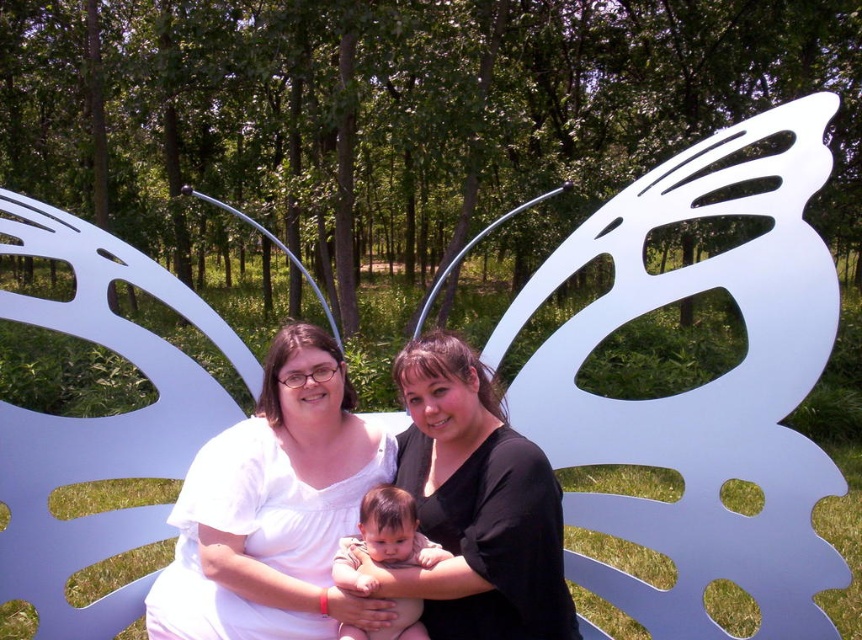
What do you see at coordinates (273, 508) in the screenshot? The image size is (862, 640). I see `white matte shirt at center` at bounding box center [273, 508].

Does white matte shirt at center appear under black matte shirt at center?

Indeed, white matte shirt at center is positioned under black matte shirt at center.

Is point (334, 506) positioned in front of point (498, 636)?

No, it is behind (498, 636).

The width and height of the screenshot is (862, 640). Identify the location of white matte shirt at center. (273, 508).

Can you confirm if white matte shirt at center is positioned below smooth skin baby at center?

No, white matte shirt at center is not below smooth skin baby at center.

Is point (273, 403) positioned before point (405, 513)?

No, (273, 403) is further to viewer.

The width and height of the screenshot is (862, 640). I want to click on white matte shirt at center, so click(273, 508).

Which is above, black matte shirt at center or smooth skin baby at center?

black matte shirt at center is above.

In the scene shown: How far apart are black matte shirt at center and smooth skin baby at center?

black matte shirt at center is 18.38 centimeters from smooth skin baby at center.

The image size is (862, 640). What do you see at coordinates (478, 502) in the screenshot?
I see `black matte shirt at center` at bounding box center [478, 502].

What are the coordinates of `black matte shirt at center` in the screenshot? It's located at pos(478,502).